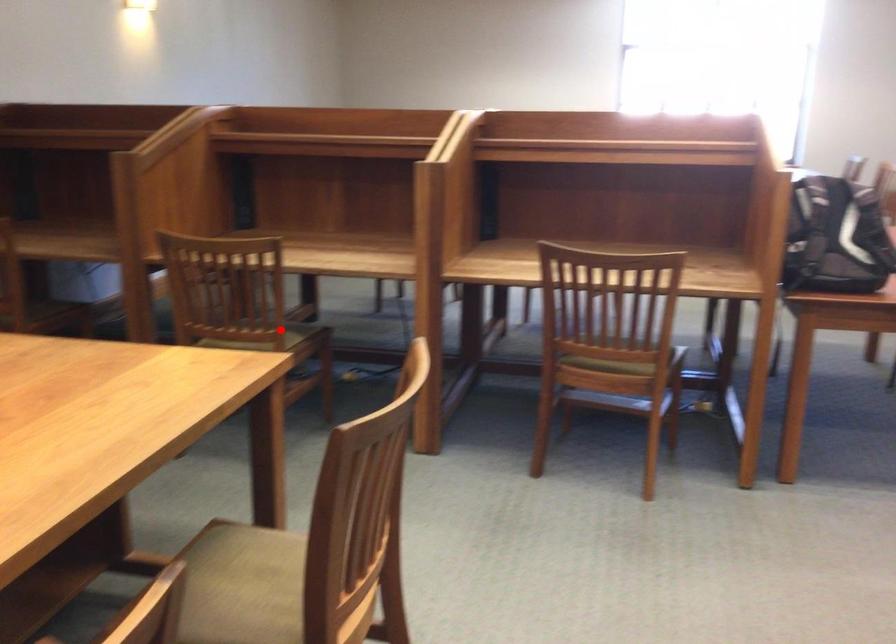
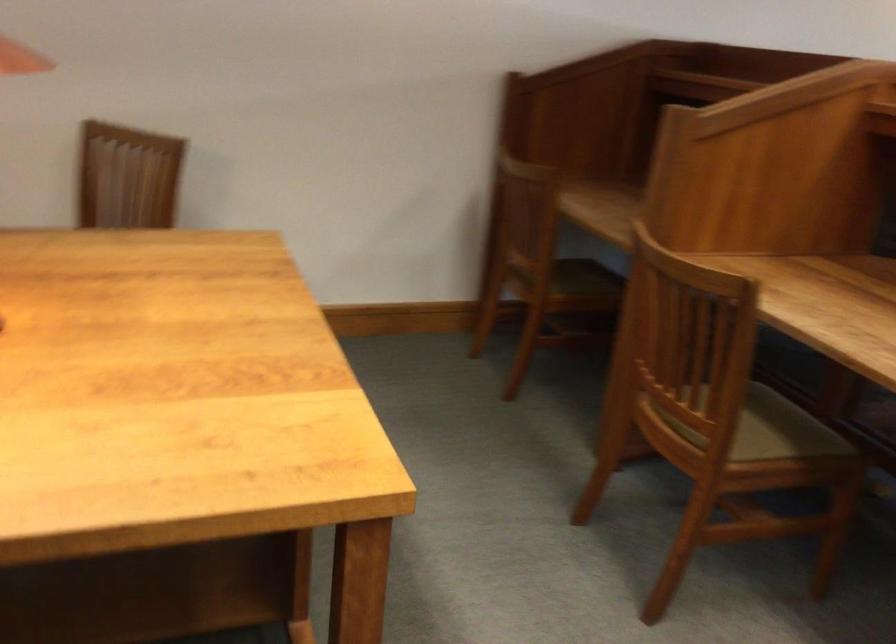
Where in the second image is the point corresponding to the highlighted location from the first image?

(765, 428)